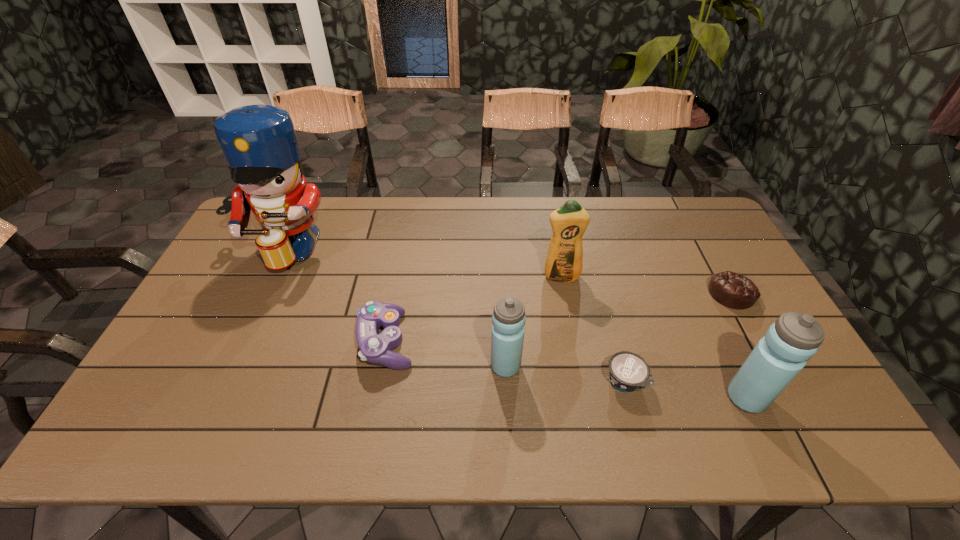
You are a GUI agent. You are given a task and a screenshot of the screen. Output one action in this format:
    pyautogui.click(x=<x>, y=<y>)
    Task: Click on the vacant place for an extra water bottle on the left
    
    Given the screenshot: What is the action you would take?
    click(291, 338)